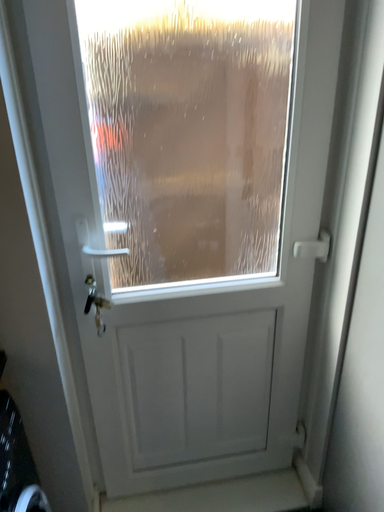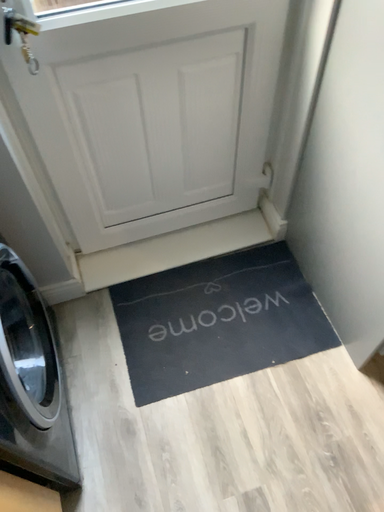
Question: Which way did the camera rotate in the video?

Choices:
 (A) rotated left
 (B) rotated right

Answer: (B)